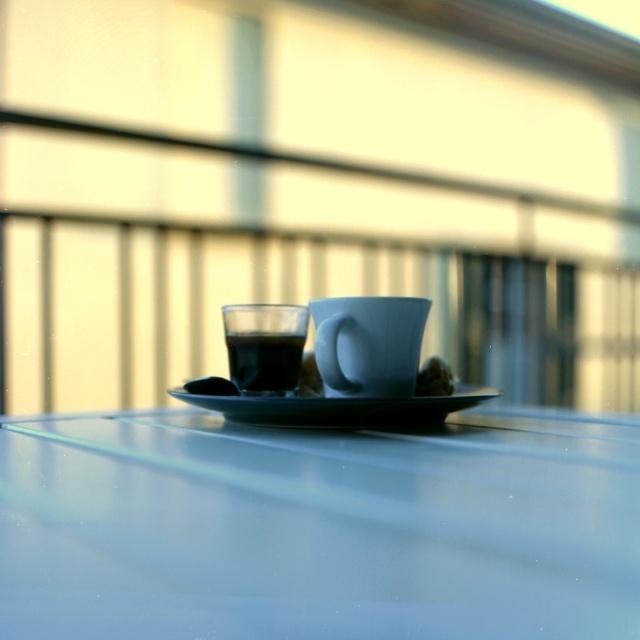
Who is shorter, black glossy saucer at center or satin brown sugar cube at center?

black glossy saucer at center is shorter.

Does black glossy saucer at center appear on the right side of satin brown sugar cube at center?

Yes, black glossy saucer at center is to the right of satin brown sugar cube at center.

Identify the location of black glossy saucer at center. The width and height of the screenshot is (640, 640). (339, 408).

Where is `black glossy saucer at center`? Image resolution: width=640 pixels, height=640 pixels. black glossy saucer at center is located at coordinates (339, 408).

Consider the image. Is matte ceramic cup at center below black glossy saucer at center?

Answer: No, matte ceramic cup at center is not below black glossy saucer at center.

Between point (340, 332) and point (413, 420), which one is positioned behind?

The point (340, 332) is more distant.

Is point (358, 346) farther from camera compared to point (262, 413)?

Yes, point (358, 346) is farther from viewer.

Where is `matte ceramic cup at center`? This screenshot has height=640, width=640. matte ceramic cup at center is located at coordinates (369, 344).

Does glossy glass table at center have a lesser width compared to black glossy saucer at center?

In fact, glossy glass table at center might be wider than black glossy saucer at center.

Can you confirm if glossy glass table at center is positioned below black glossy saucer at center?

Yes, glossy glass table at center is below black glossy saucer at center.

Is point (198, 554) closer to viewer compared to point (352, 403)?

Yes, it is.

Find the location of a particular element. The height and width of the screenshot is (640, 640). glossy glass table at center is located at coordinates (317, 528).